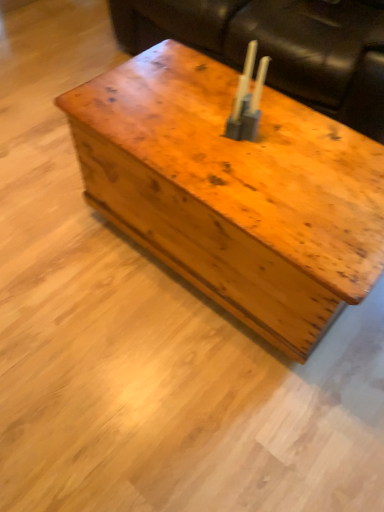
This screenshot has height=512, width=384. I want to click on vacant area to the left of wooden trunk at center, so click(x=61, y=244).